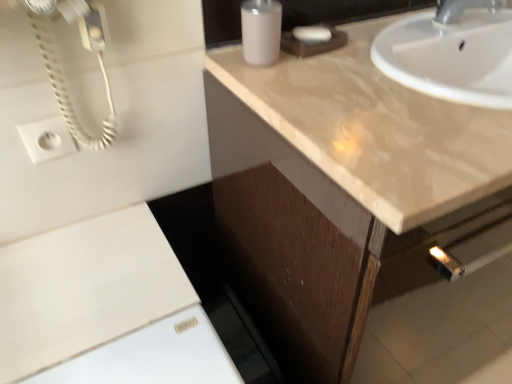
Question: Looking at their shapes, would you say white matte soap at upper center is wider or thinner than white plastic outlet at upper left?

Choices:
 (A) wide
 (B) thin

Answer: (A)

Question: Is point (318, 26) positioned closer to the camera than point (29, 147)?

Choices:
 (A) closer
 (B) farther

Answer: (B)

Question: Which of these objects is positioned farthest from the glossy beige countertop at upper right?

Choices:
 (A) white matte soap at upper center
 (B) matte plastic soap dispenser at upper center
 (C) white plastic outlet at upper left
 (D) matte brown cabinet at upper right
 (E) white matte cabinet at lower left

Answer: (C)

Question: Which is nearer to the matte brown cabinet at upper right?

Choices:
 (A) white plastic outlet at upper left
 (B) matte plastic soap dispenser at upper center
 (C) white matte soap at upper center
 (D) glossy beige countertop at upper right
 (E) white matte cabinet at lower left

Answer: (D)